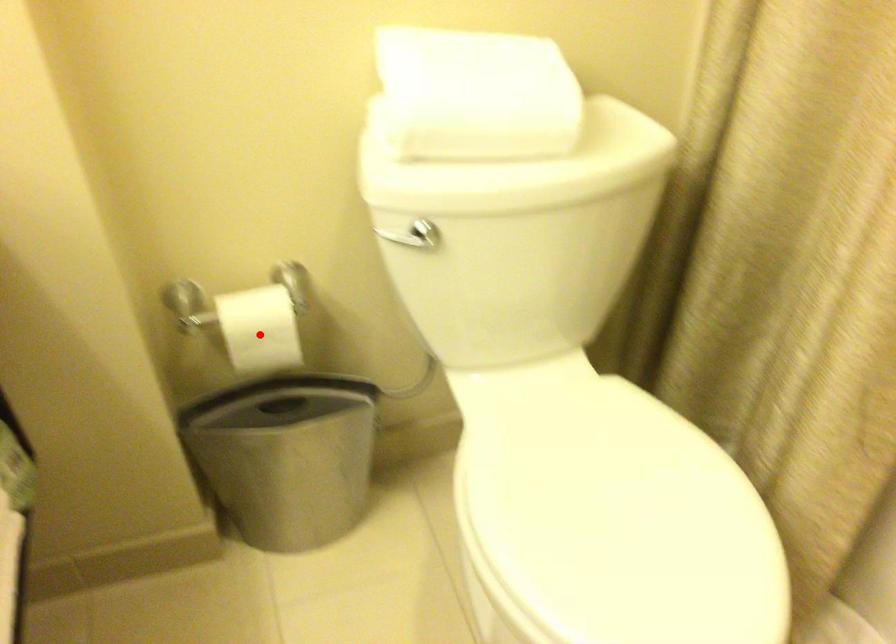
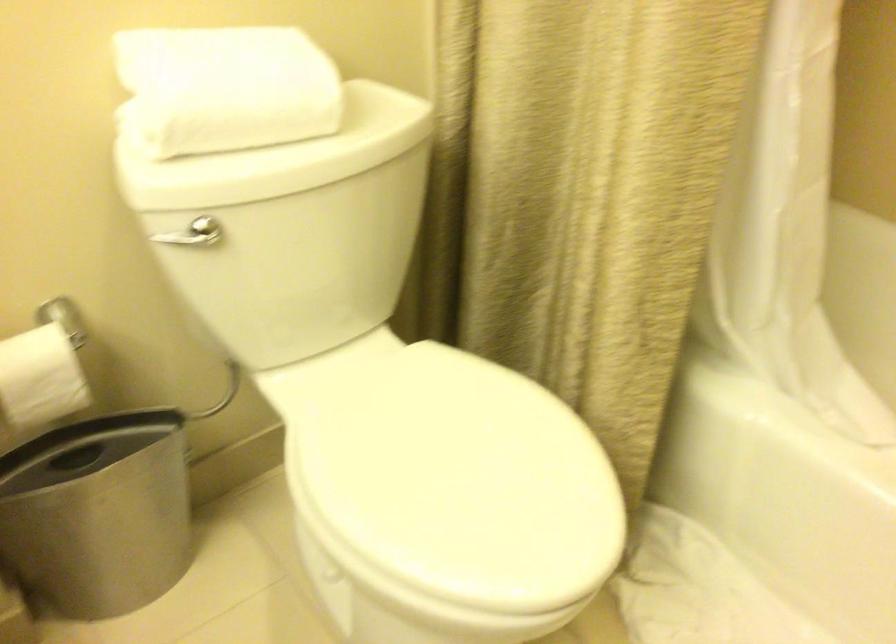
Question: I am providing you with two images of the same scene from different viewpoints. In image1, a red point is highlighted. Considering the same 3D point in image2, which of the following is correct?

Choices:
 (A) It is closer
 (B) It is farther

Answer: (A)